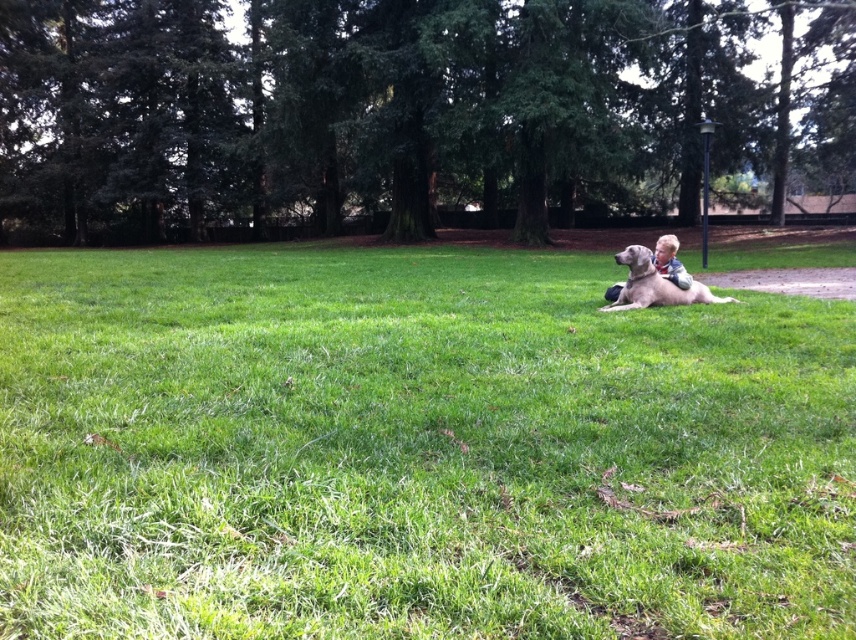
You are standing at the point labeled as point (414, 449) in the scene. What is the terrain like at that location?

The point (414, 449) corresponds to the green grassy field at center, which is lush and slightly uneven with patches of dirt and scattered leaves.

You are planning to set up a picnic blanket in the green grassy field at center. Considering the light brown fur at center is already occupying part of the field, will there be enough space for your blanket?

The green grassy field at center is wider than the light brown fur at center, so there should be enough space for your picnic blanket after accounting for the occupied area.